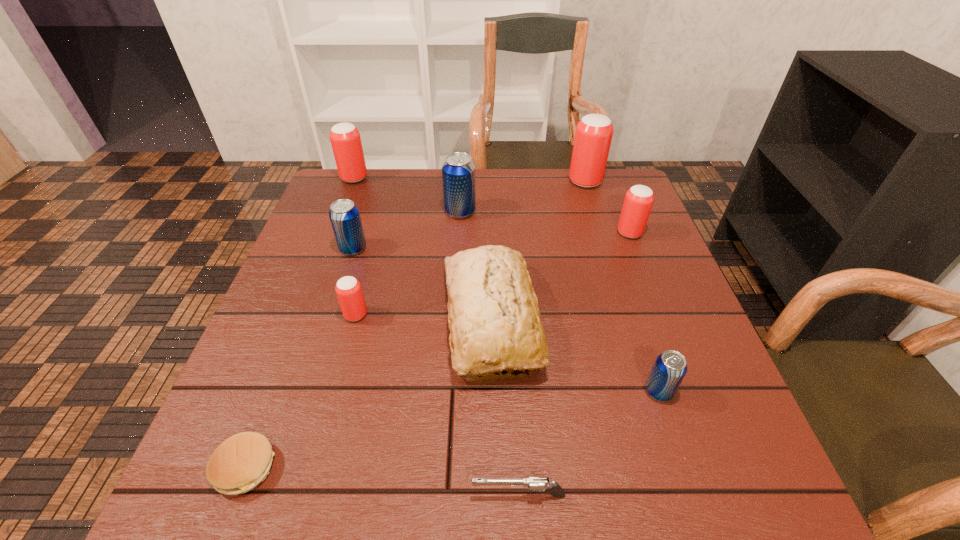
Find the location of a particular element. The height and width of the screenshot is (540, 960). patty positioned at the left edge is located at coordinates click(x=241, y=462).

Where is `object that is positioned at the far left corner`? This screenshot has height=540, width=960. object that is positioned at the far left corner is located at coordinates (345, 139).

At what (x,y) coordinates should I click in order to perform the action: click on object that is at the near left corner. Please return your answer as a coordinate pair (x, y). This screenshot has height=540, width=960. Looking at the image, I should click on (241, 462).

Where is `object that is at the far right corner`? object that is at the far right corner is located at coordinates (593, 136).

The height and width of the screenshot is (540, 960). In order to click on vacant area at the far edge of the desktop in this screenshot , I will do `click(486, 188)`.

You are a GUI agent. You are given a task and a screenshot of the screen. Output one action in this format:
    pyautogui.click(x=<x>, y=<y>)
    Task: Click on the free space at the near edge of the desktop
    The height and width of the screenshot is (540, 960).
    Given the screenshot: What is the action you would take?
    pyautogui.click(x=436, y=502)

I want to click on vacant space at the left edge, so click(313, 287).

Image resolution: width=960 pixels, height=540 pixels. In the image, there is a desktop. In order to click on free region at the right edge in this screenshot , I will do `click(635, 277)`.

In the image, there is a desktop. Identify the location of vacant space at the far left corner. This screenshot has height=540, width=960. tap(371, 182).

The width and height of the screenshot is (960, 540). I want to click on free space between the sixth farthest beer can and the second shortest object, so click(437, 404).